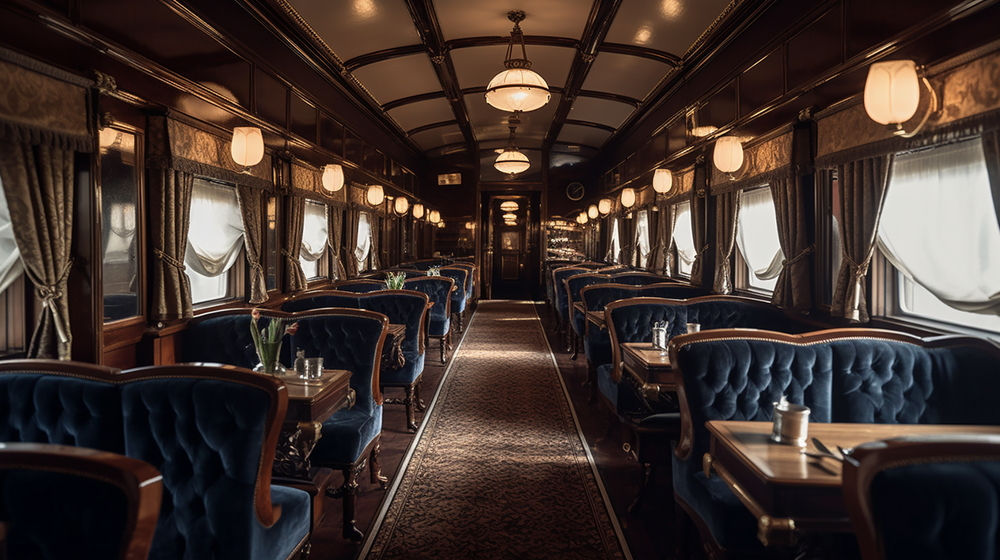
At what (x,y) coordinates should I click in order to perform the action: click on ceiling light. Please return your answer as a coordinate pair (x, y). Looking at the image, I should click on (506, 100), (511, 164), (507, 205), (507, 222).